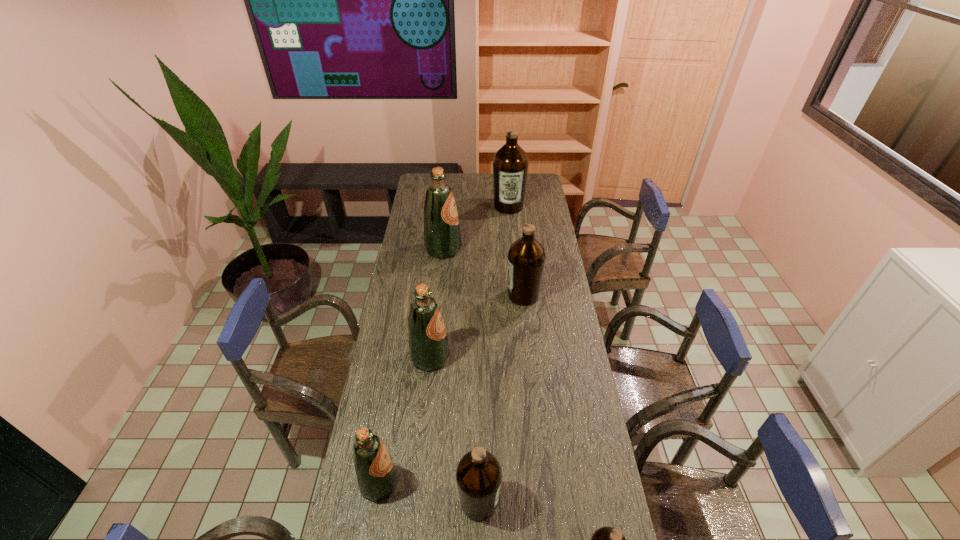
The image size is (960, 540). Identify the location of the biggest green olive oil. (442, 239).

The width and height of the screenshot is (960, 540). Identify the location of the sixth nearest olive oil. tap(442, 239).

The width and height of the screenshot is (960, 540). What are the coordinates of `the farthest olive oil` in the screenshot? It's located at (510, 164).

Image resolution: width=960 pixels, height=540 pixels. In order to click on the farthest brown olive oil in this screenshot , I will do `click(510, 164)`.

Where is `the second nearest green olive oil`? the second nearest green olive oil is located at coordinates (428, 346).

Identify the location of the fourth farthest object. (428, 346).

I want to click on the second farthest brown olive oil, so click(x=526, y=257).

Locate an element on the screen. The image size is (960, 540). the second biggest brown olive oil is located at coordinates (526, 257).

What are the coordinates of `the nearest green olive oil` in the screenshot? It's located at (375, 470).

At what (x,y) coordinates should I click in order to perform the action: click on the second nearest brown olive oil. Please return your answer as a coordinate pair (x, y). Image resolution: width=960 pixels, height=540 pixels. Looking at the image, I should click on (478, 475).